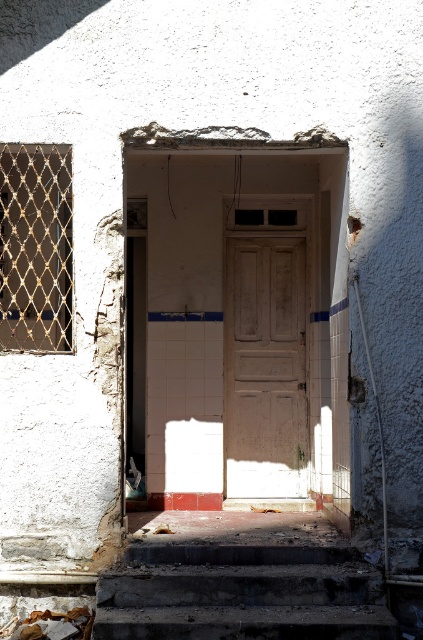
You are standing at the entrance of the abandoned building and want to locate two specific points marked on the door. The first point is at coordinate point (109, 586) and the second is at point (0, 632). Which point is closer to you when you face the door?

Point (0, 632) is closer to you because it is in front of point (109, 586) when facing the door.

You are a delivery person trying to reach the white matte door at center. You see the dark concrete stairs at lower center. Are the stairs blocking your path to the door?

The dark concrete stairs at lower center is in front of white matte door at center, so the stairs are blocking the path to the door.